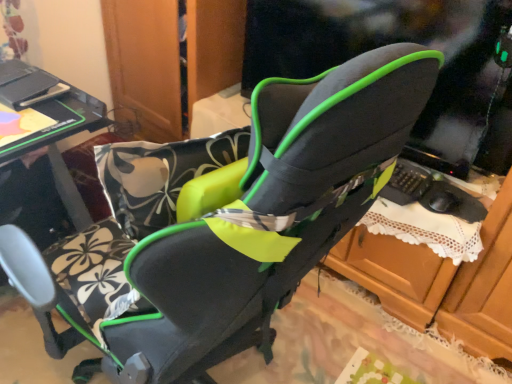
Question: Considering the positions of black glossy table at left and black fabric dresser at center in the image, is black glossy table at left taller or shorter than black fabric dresser at center?

Choices:
 (A) short
 (B) tall

Answer: (B)

Question: Based on their sizes in the image, would you say black glossy table at left is bigger or smaller than black fabric dresser at center?

Choices:
 (A) small
 (B) big

Answer: (A)

Question: From a real-world perspective, relative to black fabric dresser at center, is black glossy table at left vertically above or below?

Choices:
 (A) above
 (B) below

Answer: (A)

Question: Which is correct: black fabric dresser at center is inside black glossy table at left, or outside of it?

Choices:
 (A) inside
 (B) outside

Answer: (B)

Question: Is black fabric dresser at center wider or thinner than black glossy table at left?

Choices:
 (A) wide
 (B) thin

Answer: (A)

Question: Is black fabric dresser at center bigger or smaller than black glossy table at left?

Choices:
 (A) small
 (B) big

Answer: (B)

Question: Is black fabric dresser at center to the left or to the right of black glossy table at left in the image?

Choices:
 (A) left
 (B) right

Answer: (B)